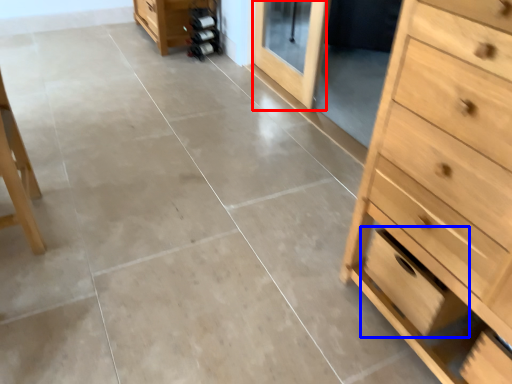
Question: Which of the following is the farthest to the observer, screen door (highlighted by a red box) or drawer (highlighted by a blue box)?

Choices:
 (A) screen door
 (B) drawer

Answer: (A)